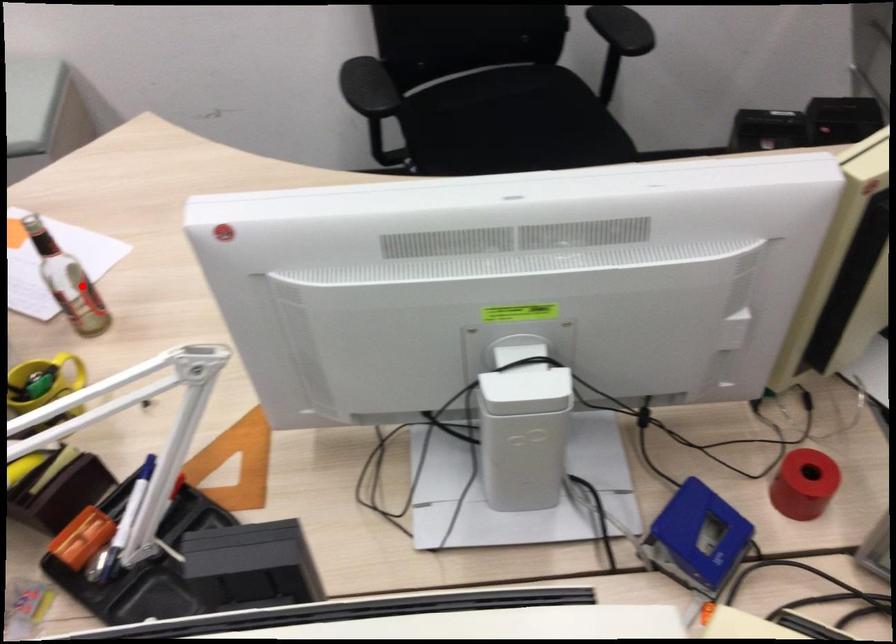
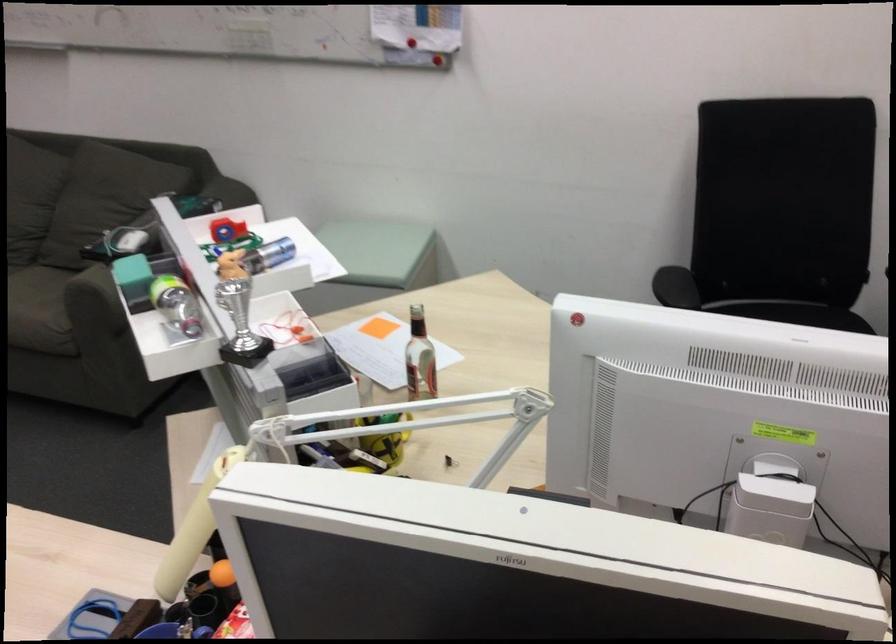
In the second image, find the point that corresponds to the highlighted location in the first image.

(419, 359)